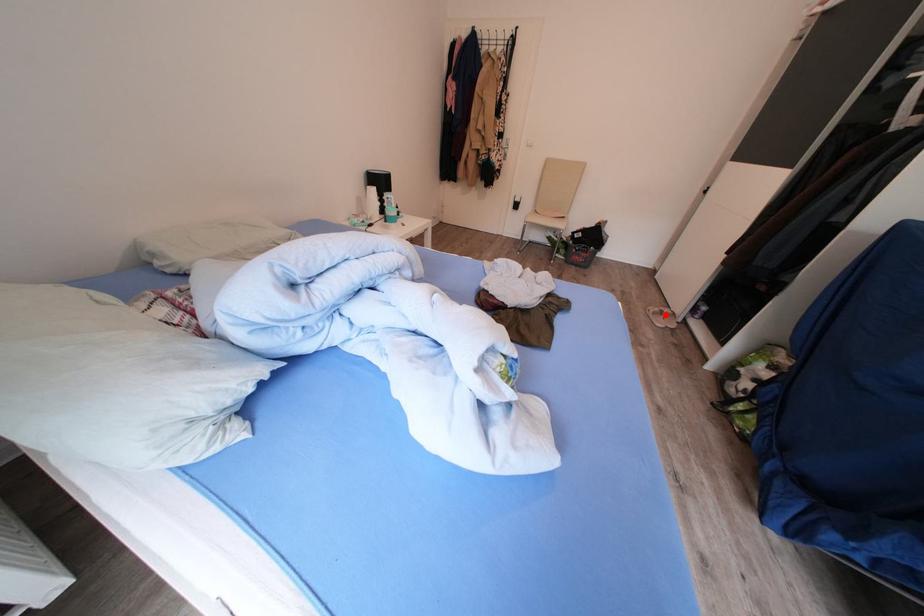
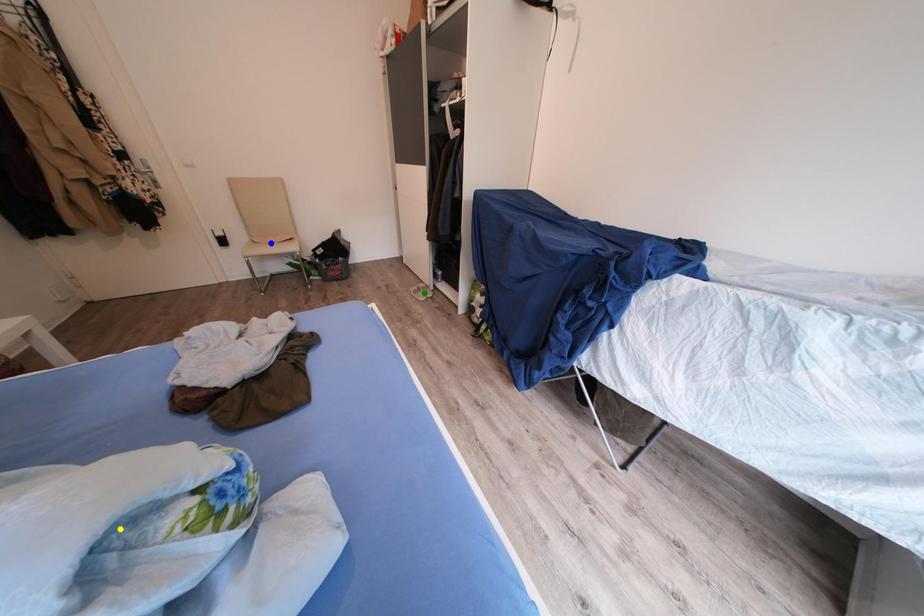
Question: I am providing you with two images of the same scene from different viewpoints. A red point is marked on the first image. You are given multiple points on the second image. Which point in image 2 represents the same 3d spot as the red point in image 1?

Choices:
 (A) blue point
 (B) green point
 (C) yellow point

Answer: (B)